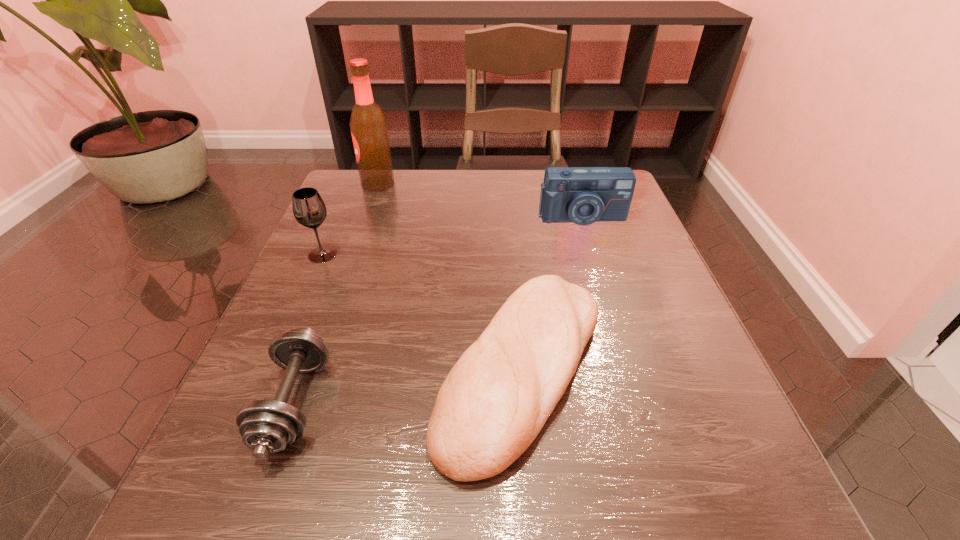
The image size is (960, 540). I want to click on camera that is at the right edge, so click(x=583, y=195).

Identify the location of bread located at the right edge. The width and height of the screenshot is (960, 540). (495, 400).

I want to click on object present at the far left corner, so click(x=368, y=125).

Locate an element on the screen. The width and height of the screenshot is (960, 540). object at the near left corner is located at coordinates (267, 426).

Where is `object present at the far right corner`? object present at the far right corner is located at coordinates (583, 195).

Where is `object positioned at the near right corner`? object positioned at the near right corner is located at coordinates (495, 400).

The image size is (960, 540). Identify the location of vacant space at the far edge of the desktop. (423, 175).

Identify the location of vacant space at the near edge of the desktop. (418, 521).

This screenshot has height=540, width=960. In the image, there is a desktop. What are the coordinates of `vacant region at the left edge` in the screenshot? It's located at (259, 382).

At what (x,y) coordinates should I click in order to perform the action: click on blank space at the right edge. Please return your answer as a coordinate pair (x, y). Looking at the image, I should click on (580, 239).